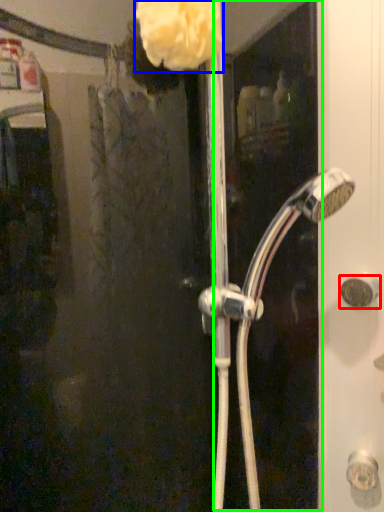
Question: Which object is the farthest from door handle (highlighted by a red box)? Choose among these: flower (highlighted by a blue box) or screen door (highlighted by a green box).

Choices:
 (A) flower
 (B) screen door

Answer: (A)